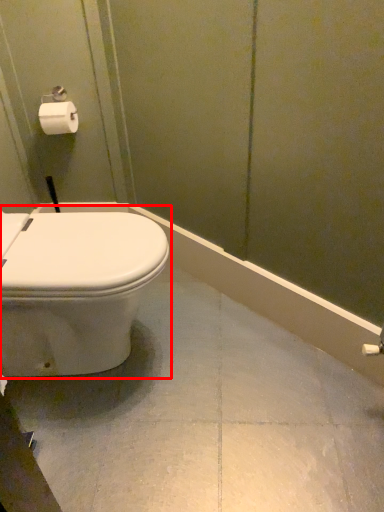
Question: From the image, what is the correct spatial relationship of toilet (annotated by the red box) in relation to toilet paper?

Choices:
 (A) left
 (B) right

Answer: (B)